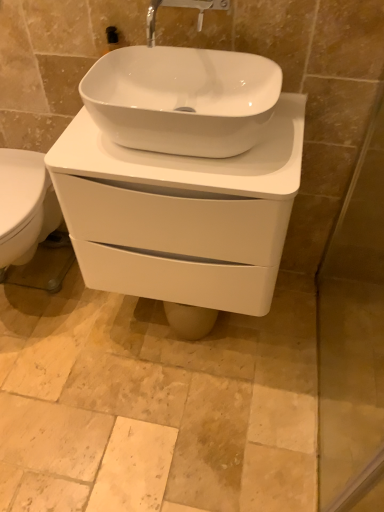
This screenshot has height=512, width=384. Find the location of `free space in front of transparent glass screen door at right`. free space in front of transparent glass screen door at right is located at coordinates (323, 432).